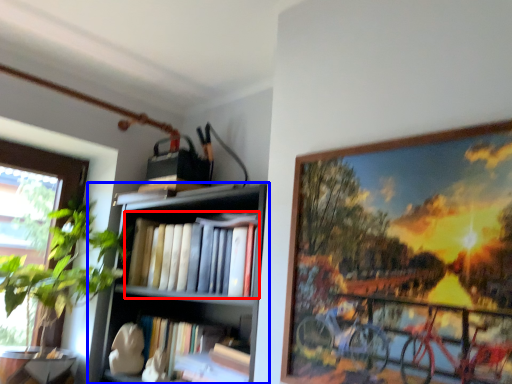
Question: Which point is further to the camera, book (highlighted by a red box) or shelf (highlighted by a blue box)?

Choices:
 (A) book
 (B) shelf

Answer: (A)